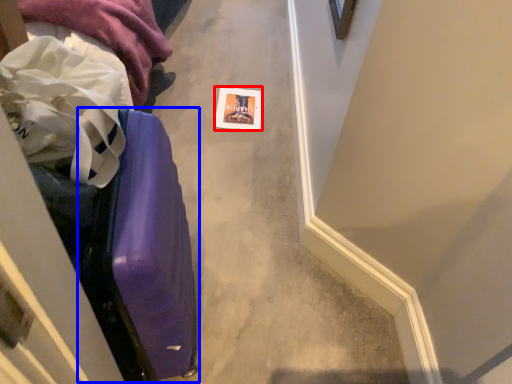
Question: Which object is further to the camera taking this photo, postcard (highlighted by a red box) or luggage (highlighted by a blue box)?

Choices:
 (A) postcard
 (B) luggage

Answer: (A)